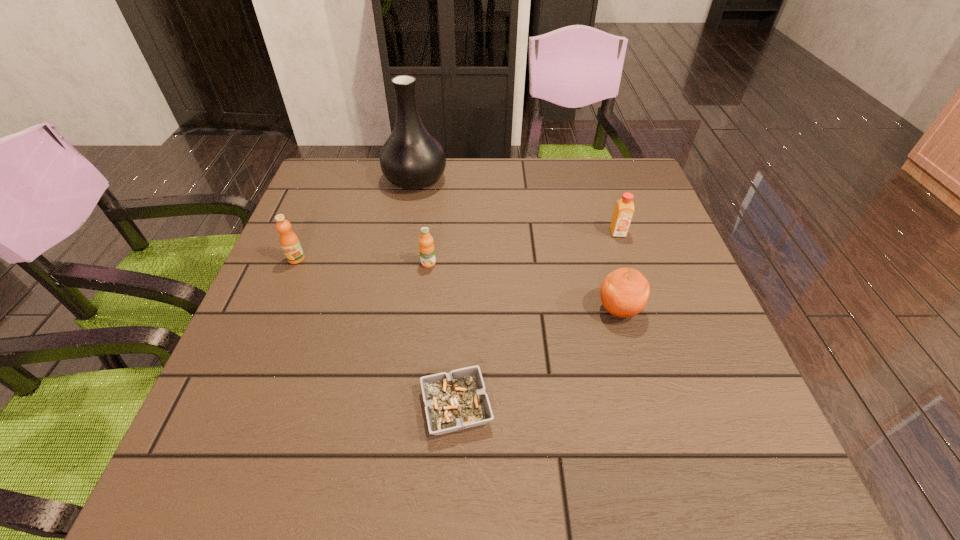
Locate an element on the screen. Image resolution: width=960 pixels, height=540 pixels. free spot that satisfies the following two spatial constraints: 1. on the label of the second orange juice from left to right; 2. on the left side of the second nearest object is located at coordinates (423, 309).

Identify the location of vacant space that satisfies the following two spatial constraints: 1. on the label of the second orange juice from right to left; 2. on the right side of the ashtray. This screenshot has height=540, width=960. pos(412,407).

The image size is (960, 540). Identify the location of vacant space that satisfies the following two spatial constraints: 1. on the label of the shortest object; 2. on the right side of the second orange juice from left to right. (412, 407).

At what (x,y) coordinates should I click in order to perform the action: click on vacant position in the image that satisfies the following two spatial constraints: 1. on the front label of the orange; 2. on the left side of the leftmost orange juice. Please return your answer as a coordinate pair (x, y). The height and width of the screenshot is (540, 960). Looking at the image, I should click on (276, 309).